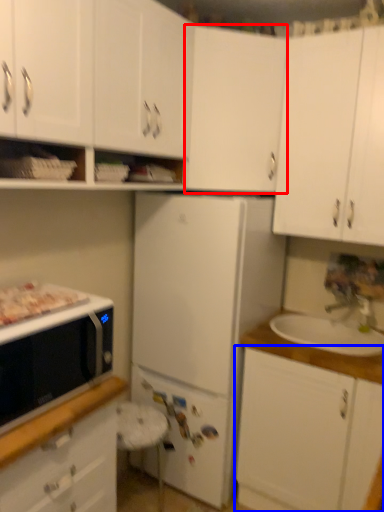
Question: Among these objects, which one is nearest to the camera, cabinetry (highlighted by a red box) or cabinetry (highlighted by a blue box)?

Choices:
 (A) cabinetry
 (B) cabinetry

Answer: (B)